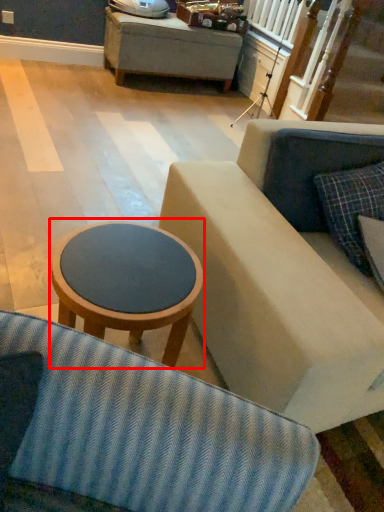
Question: From the image's perspective, where is table (annotated by the red box) located relative to pillow?

Choices:
 (A) below
 (B) above

Answer: (A)